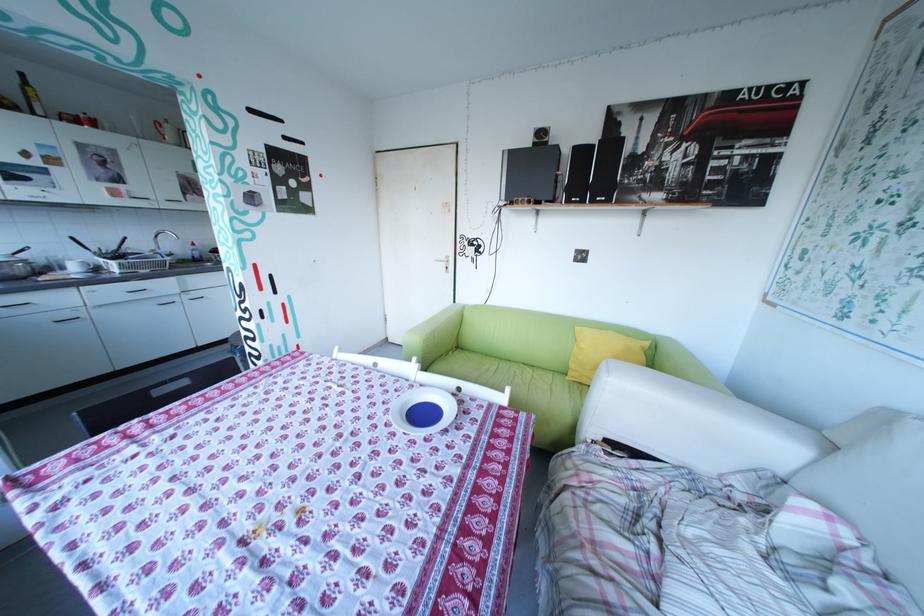
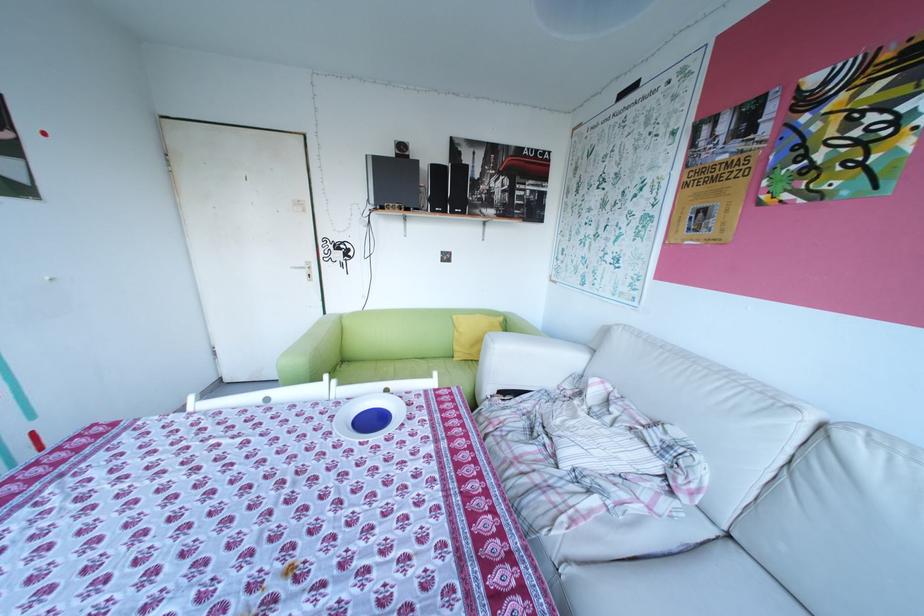
In the second image, find the point that corresponds to pixel 605 201 in the first image.

(466, 212)